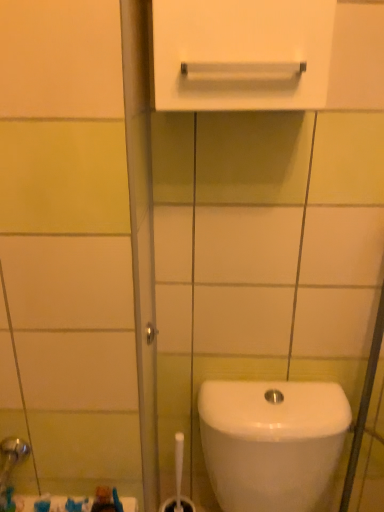
Question: From a real-world perspective, is white glossy toilet at lower right beneath white glossy towel bar at upper center?

Choices:
 (A) yes
 (B) no

Answer: (A)

Question: Is white glossy toilet at lower right to the left of white glossy towel bar at upper center from the viewer's perspective?

Choices:
 (A) yes
 (B) no

Answer: (B)

Question: Is white glossy toilet at lower right oriented towards white glossy towel bar at upper center?

Choices:
 (A) no
 (B) yes

Answer: (A)

Question: Does white glossy toilet at lower right lie behind white glossy towel bar at upper center?

Choices:
 (A) no
 (B) yes

Answer: (B)

Question: Is white glossy toilet at lower right thinner than white glossy towel bar at upper center?

Choices:
 (A) no
 (B) yes

Answer: (A)

Question: In terms of width, does white glossy toilet at lower right look wider or thinner when compared to white glossy towel bar at upper center?

Choices:
 (A) wide
 (B) thin

Answer: (A)

Question: Is white glossy toilet at lower right in front of or behind white glossy towel bar at upper center in the image?

Choices:
 (A) front
 (B) behind

Answer: (B)

Question: Is point (344, 398) positioned closer to the camera than point (162, 48)?

Choices:
 (A) farther
 (B) closer

Answer: (A)

Question: From their relative heights in the image, would you say white glossy toilet at lower right is taller or shorter than white glossy towel bar at upper center?

Choices:
 (A) short
 (B) tall

Answer: (B)

Question: In terms of width, does white glossy towel bar at upper center look wider or thinner when compared to white glossy toilet at lower right?

Choices:
 (A) wide
 (B) thin

Answer: (B)

Question: From the image's perspective, is white glossy towel bar at upper center positioned above or below white glossy toilet at lower right?

Choices:
 (A) above
 (B) below

Answer: (A)

Question: Would you say white glossy towel bar at upper center is to the left or to the right of white glossy toilet at lower right in the picture?

Choices:
 (A) right
 (B) left

Answer: (B)

Question: Considering their positions, is white glossy towel bar at upper center located in front of or behind white glossy toilet at lower right?

Choices:
 (A) behind
 (B) front

Answer: (B)

Question: From the image's perspective, is white glossy toilet at lower right above or below white plastic brush at lower center?

Choices:
 (A) above
 (B) below

Answer: (A)

Question: Would you say white glossy toilet at lower right is to the left or to the right of white plastic brush at lower center in the picture?

Choices:
 (A) left
 (B) right

Answer: (B)